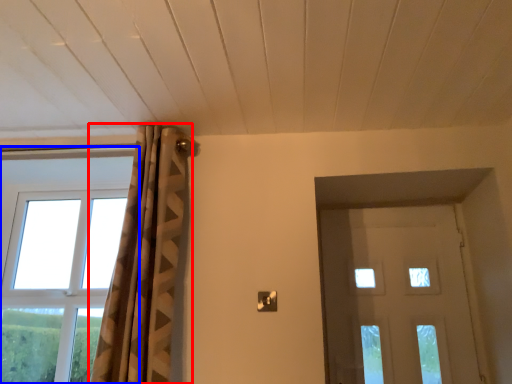
Question: Among these objects, which one is farthest to the camera, curtain (highlighted by a red box) or window (highlighted by a blue box)?

Choices:
 (A) curtain
 (B) window

Answer: (B)